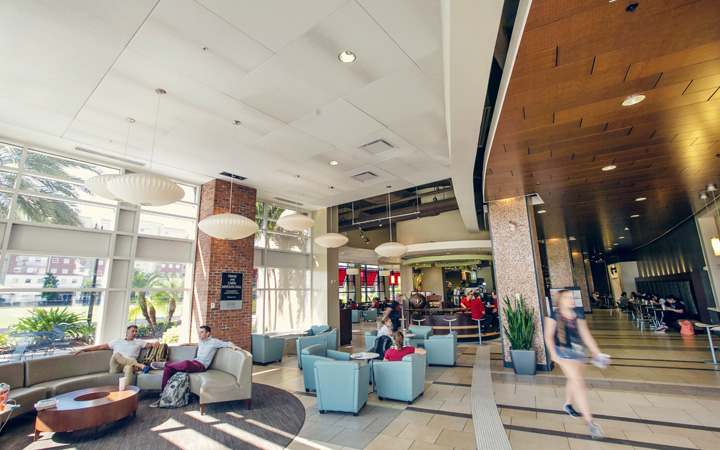
Locate an element on the screen. table is located at coordinates (78, 405).